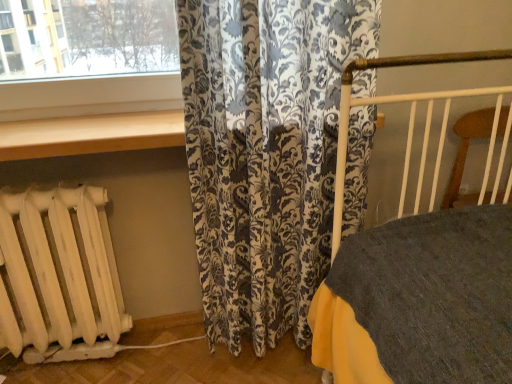
Question: Does floral-patterned fabric at center have a greater width compared to wooden at upper center?

Choices:
 (A) no
 (B) yes

Answer: (A)

Question: From the image's perspective, is floral-patterned fabric at center under wooden at upper center?

Choices:
 (A) no
 (B) yes

Answer: (B)

Question: Is there a large distance between floral-patterned fabric at center and wooden at upper center?

Choices:
 (A) no
 (B) yes

Answer: (A)

Question: Considering the relative positions of floral-patterned fabric at center and wooden at upper center in the image provided, is floral-patterned fabric at center behind wooden at upper center?

Choices:
 (A) yes
 (B) no

Answer: (B)

Question: Is floral-patterned fabric at center aimed at wooden at upper center?

Choices:
 (A) no
 (B) yes

Answer: (A)

Question: Does floral-patterned fabric at center have a greater height compared to wooden at upper center?

Choices:
 (A) no
 (B) yes

Answer: (B)

Question: From a real-world perspective, is wooden at upper center over floral-patterned fabric at center?

Choices:
 (A) no
 (B) yes

Answer: (B)

Question: From the image's perspective, is wooden at upper center below floral-patterned fabric at center?

Choices:
 (A) no
 (B) yes

Answer: (A)

Question: Considering the relative sizes of wooden at upper center and floral-patterned fabric at center in the image provided, is wooden at upper center bigger than floral-patterned fabric at center?

Choices:
 (A) yes
 (B) no

Answer: (B)

Question: Is floral-patterned fabric at center located within wooden at upper center?

Choices:
 (A) yes
 (B) no

Answer: (B)

Question: Considering the relative sizes of wooden at upper center and floral-patterned fabric at center in the image provided, is wooden at upper center smaller than floral-patterned fabric at center?

Choices:
 (A) yes
 (B) no

Answer: (A)

Question: Is the depth of wooden at upper center less than that of floral-patterned fabric at center?

Choices:
 (A) no
 (B) yes

Answer: (A)

Question: Does white matte radiator at lower left contain wooden at upper center?

Choices:
 (A) no
 (B) yes

Answer: (A)